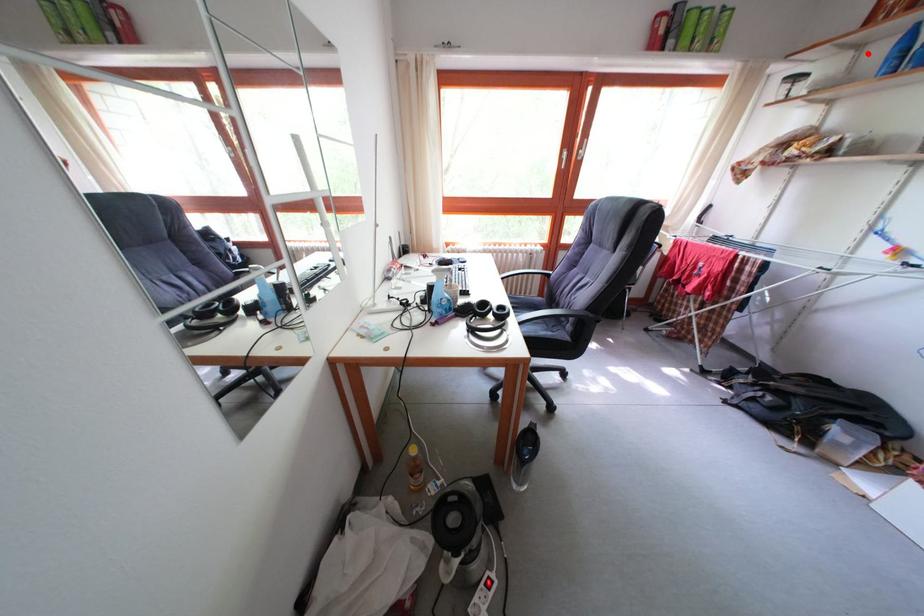
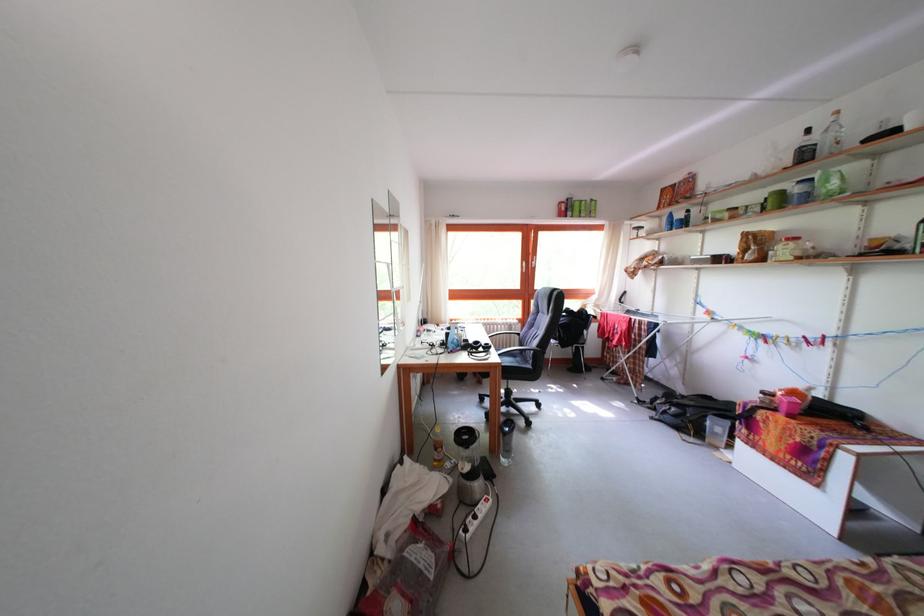
Question: I am providing you with two images of the same scene from different viewpoints. A red point is shown in image1. For the corresponding object point in image2, is it positioned nearer or farther from the camera?

Choices:
 (A) Nearer
 (B) Farther

Answer: (A)